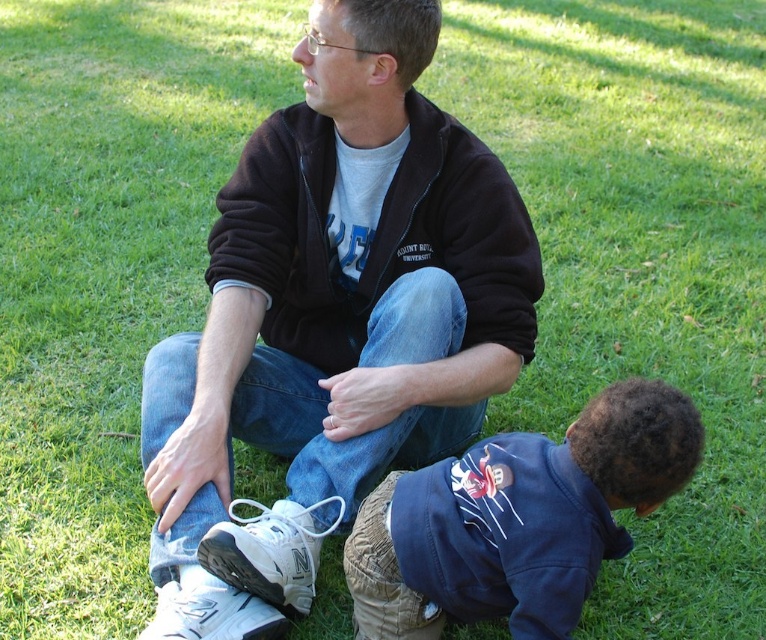
Which of these two, dark blue fleece at lower right or black fleece sweatshirt at center, stands shorter?

dark blue fleece at lower right

Is dark blue fleece at lower right thinner than black fleece sweatshirt at center?

Yes, dark blue fleece at lower right is thinner than black fleece sweatshirt at center.

Between point (466, 518) and point (280, 232), which one is positioned in front?

Point (466, 518) is more forward.

Find the location of a particular element. dark blue fleece at lower right is located at coordinates (516, 518).

Image resolution: width=766 pixels, height=640 pixels. What do you see at coordinates (332, 321) in the screenshot?
I see `matte black jacket at center` at bounding box center [332, 321].

This screenshot has width=766, height=640. I want to click on matte black jacket at center, so click(x=332, y=321).

Does matte black jacket at center have a lesser height compared to dark blue fleece at lower right?

No.

Can you confirm if matte black jacket at center is positioned below dark blue fleece at lower right?

Actually, matte black jacket at center is above dark blue fleece at lower right.

Image resolution: width=766 pixels, height=640 pixels. In order to click on matte black jacket at center in this screenshot , I will do `click(332, 321)`.

In order to click on matte black jacket at center in this screenshot , I will do `click(332, 321)`.